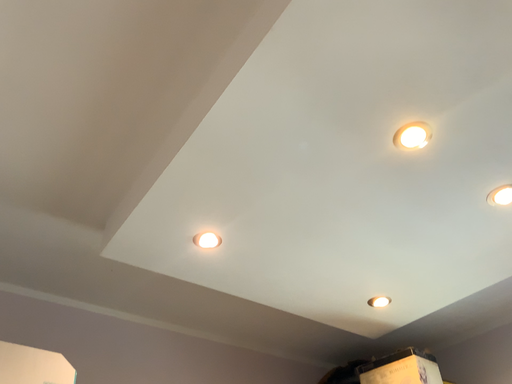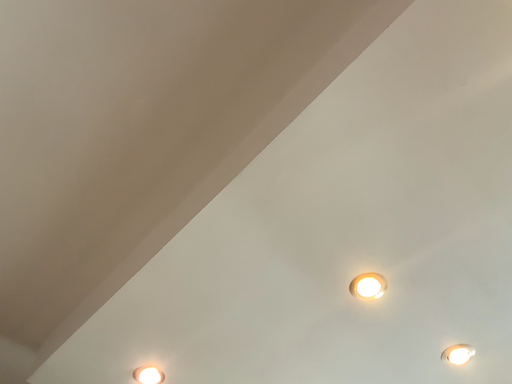
Question: How did the camera likely rotate when shooting the video?

Choices:
 (A) rotated upward
 (B) rotated downward

Answer: (A)